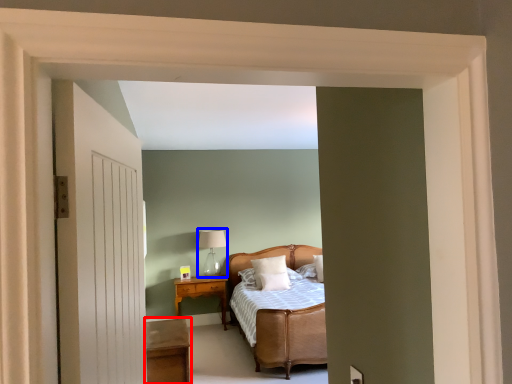
Question: Which object appears closest to the camera in this image, table (highlighted by a red box) or table lamp (highlighted by a blue box)?

Choices:
 (A) table
 (B) table lamp

Answer: (A)